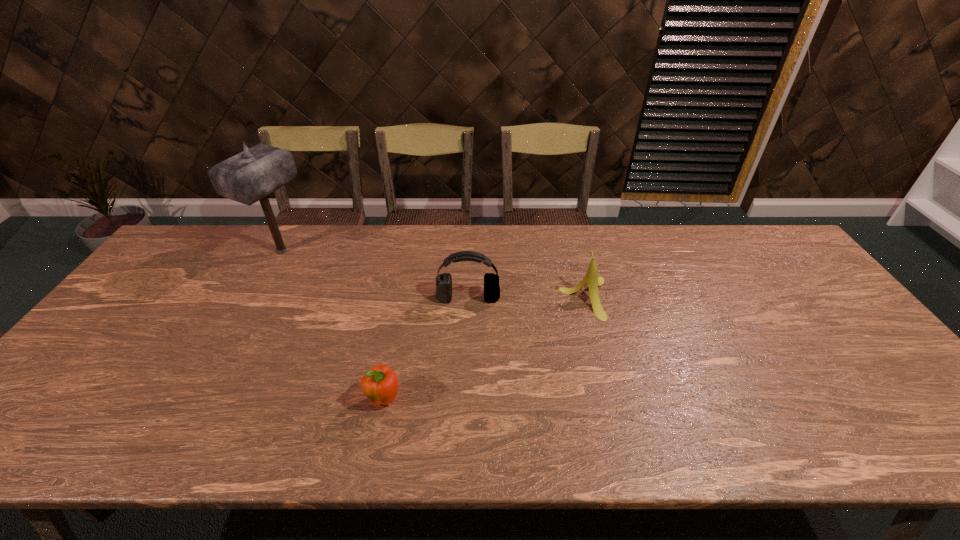
Locate an element on the screen. the leftmost object is located at coordinates click(248, 177).

You are a GUI agent. You are given a task and a screenshot of the screen. Output one action in this format:
    pyautogui.click(x=<x>, y=<y>)
    Task: Click on the tallest object
    The image size is (960, 540).
    Given the screenshot: What is the action you would take?
    pyautogui.click(x=248, y=177)

The width and height of the screenshot is (960, 540). In order to click on headset in this screenshot , I will do `click(443, 281)`.

Locate an element on the screen. The width and height of the screenshot is (960, 540). the third object from left to right is located at coordinates (443, 281).

Locate an element on the screen. This screenshot has width=960, height=540. banana is located at coordinates (591, 278).

The image size is (960, 540). In order to click on the second object from left to right in this screenshot , I will do `click(380, 384)`.

This screenshot has width=960, height=540. In order to click on the nearest object in this screenshot , I will do `click(380, 384)`.

The width and height of the screenshot is (960, 540). I want to click on vacant area situated on the front of the leftmost object, so [228, 349].

Where is `vacant area situated on the headband of the third object from left to right`? The image size is (960, 540). vacant area situated on the headband of the third object from left to right is located at coordinates (467, 342).

Where is `vacant area located on the front of the banana`? The image size is (960, 540). vacant area located on the front of the banana is located at coordinates (596, 347).